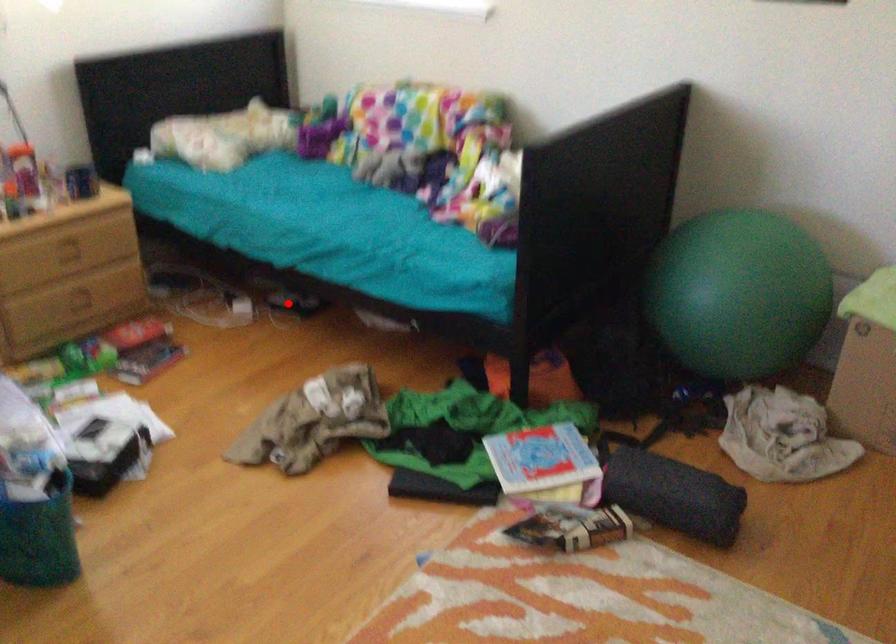
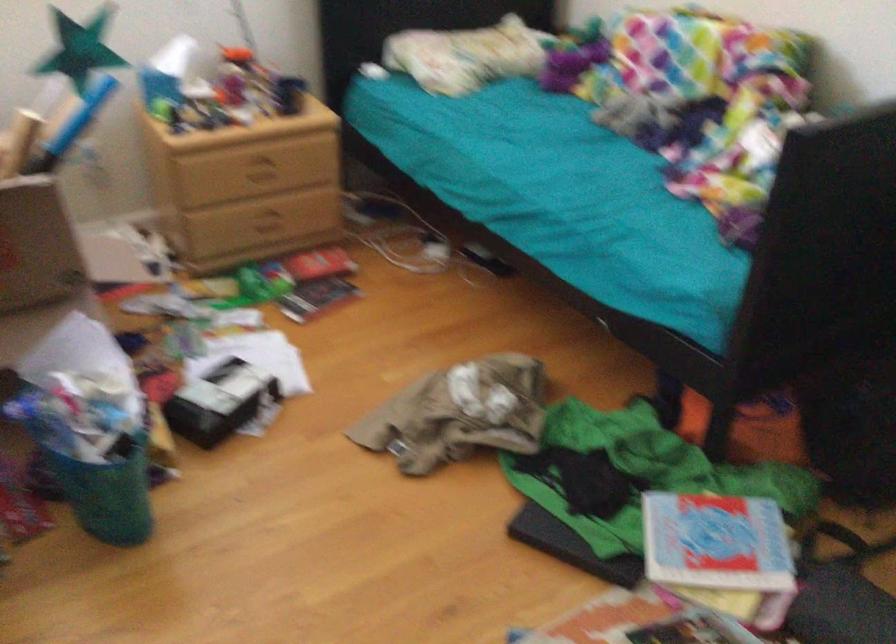
Question: I am providing you with two images of the same scene from different viewpoints. A red point is shown in image1. For the corresponding object point in image2, is it positioned nearer or farther from the camera?

Choices:
 (A) Nearer
 (B) Farther

Answer: (A)